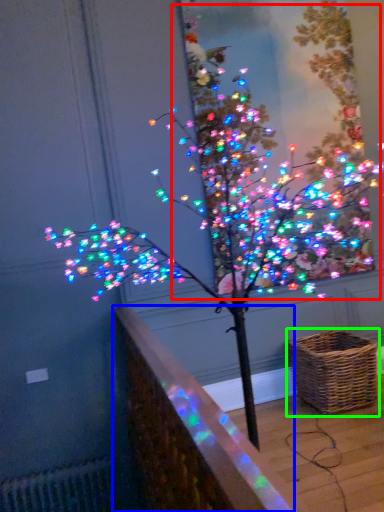
Question: Considering the real-world distances, which object is closest to christmas tree (highlighted by a red box)? ledge (highlighted by a blue box) or picnic basket (highlighted by a green box).

Choices:
 (A) ledge
 (B) picnic basket

Answer: (B)